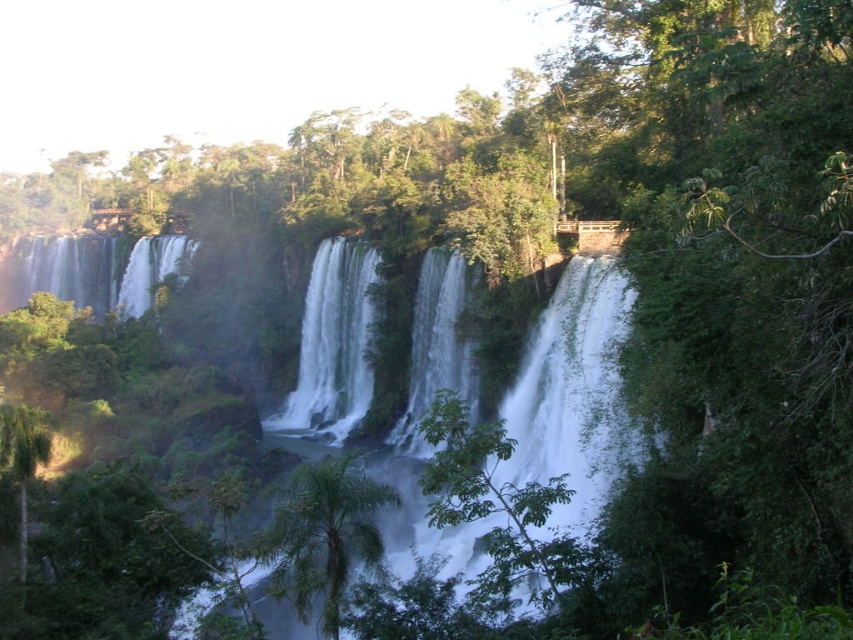
Question: Is white smooth waterfall at center closer to the viewer compared to white smooth waterfall at left?

Choices:
 (A) no
 (B) yes

Answer: (B)

Question: Does green leafy tree at center lie in front of green leafy palm tree at lower left?

Choices:
 (A) no
 (B) yes

Answer: (B)

Question: Considering the real-world distances, which object is closest to the white frothy water at center?

Choices:
 (A) green leafy palm tree at lower left
 (B) white smooth waterfall at center
 (C) white smooth waterfall at left
 (D) green leafy palm tree at center

Answer: (B)

Question: Which point appears farthest from the camera in this image?

Choices:
 (A) (474, 488)
 (B) (347, 568)
 (C) (444, 291)

Answer: (C)

Question: Which point is farther to the camera?

Choices:
 (A) white smooth waterfall at left
 (B) green leafy palm tree at lower left

Answer: (A)

Question: Is white frothy water at center behind white smooth waterfall at center?

Choices:
 (A) no
 (B) yes

Answer: (B)